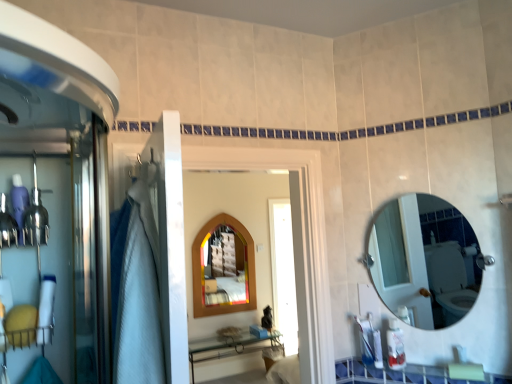
Question: Does wooden stained mirror at center, the first mirror in the back-to-front sequence, have a lesser width compared to wooden arched mirror at center?

Choices:
 (A) yes
 (B) no

Answer: (A)

Question: From a real-world perspective, is wooden stained mirror at center, which appears as the first mirror when viewed from the left, on wooden arched mirror at center?

Choices:
 (A) no
 (B) yes

Answer: (A)

Question: Considering the relative sizes of wooden stained mirror at center, which appears as the first mirror when viewed from the left, and wooden arched mirror at center in the image provided, is wooden stained mirror at center, which appears as the first mirror when viewed from the left, wider than wooden arched mirror at center?

Choices:
 (A) yes
 (B) no

Answer: (B)

Question: Is wooden arched mirror at center located within wooden stained mirror at center, which appears as the first mirror when viewed from the left?

Choices:
 (A) yes
 (B) no

Answer: (B)

Question: Does wooden stained mirror at center, the 2th mirror positioned from the front, have a larger size compared to wooden arched mirror at center?

Choices:
 (A) yes
 (B) no

Answer: (B)

Question: In terms of width, does translucent plastic bottle at lower right look wider or thinner when compared to white glossy counter top at lower center?

Choices:
 (A) wide
 (B) thin

Answer: (B)

Question: From the image's perspective, is translucent plastic bottle at lower right positioned above or below white glossy counter top at lower center?

Choices:
 (A) above
 (B) below

Answer: (A)

Question: Looking at the image, does translucent plastic bottle at lower right seem bigger or smaller compared to white glossy counter top at lower center?

Choices:
 (A) small
 (B) big

Answer: (A)

Question: Relative to white glossy counter top at lower center, is translucent plastic bottle at lower right in front or behind?

Choices:
 (A) behind
 (B) front

Answer: (A)

Question: Is white glossy counter top at lower center inside or outside of translucent plastic bottle at lower right?

Choices:
 (A) outside
 (B) inside

Answer: (A)

Question: Considering the positions of white glossy counter top at lower center and translucent plastic bottle at lower right in the image, is white glossy counter top at lower center taller or shorter than translucent plastic bottle at lower right?

Choices:
 (A) short
 (B) tall

Answer: (A)

Question: From the image's perspective, is white glossy counter top at lower center positioned above or below translucent plastic bottle at lower right?

Choices:
 (A) below
 (B) above

Answer: (A)

Question: From a real-world perspective, is white glossy counter top at lower center physically located above or below translucent plastic bottle at lower right?

Choices:
 (A) below
 (B) above

Answer: (A)

Question: Is point (322, 355) closer or farther from the camera than point (380, 233)?

Choices:
 (A) farther
 (B) closer

Answer: (B)

Question: Considering the positions of wooden arched mirror at center and clear glass mirror at upper right, which appears as the 1th mirror when viewed from the front, in the image, is wooden arched mirror at center taller or shorter than clear glass mirror at upper right, which appears as the 1th mirror when viewed from the front,?

Choices:
 (A) short
 (B) tall

Answer: (B)